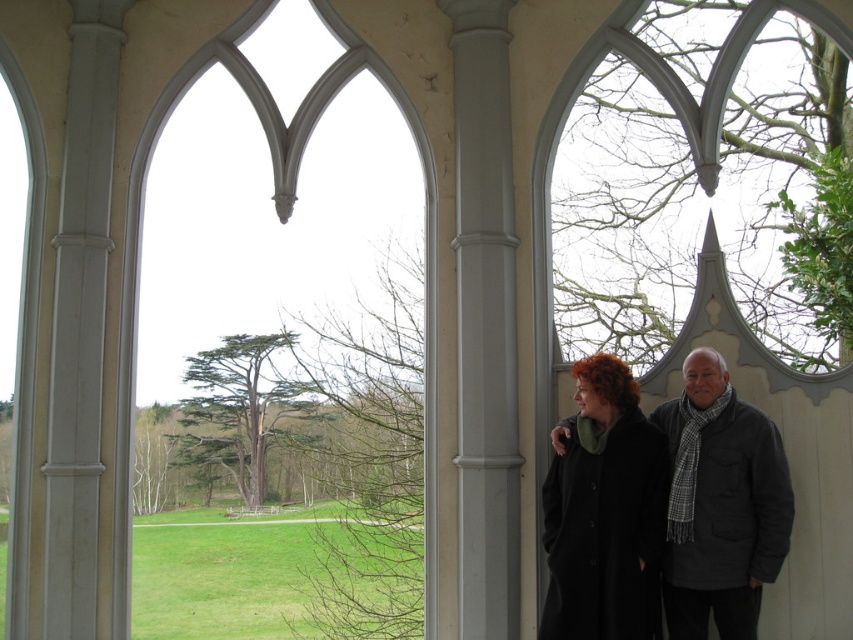
Who is lower down, clear glass window at center or gray smooth column at center?

clear glass window at center is lower down.

Does clear glass window at center have a greater height compared to gray smooth column at center?

Correct, clear glass window at center is much taller as gray smooth column at center.

Is point (364, 54) positioned after point (494, 396)?

Yes, it is behind point (494, 396).

The width and height of the screenshot is (853, 640). In order to click on clear glass window at center in this screenshot , I will do `click(271, 198)`.

Who is taller, black wool coat at center or dark gray wool scarf at right?

Standing taller between the two is dark gray wool scarf at right.

Who is positioned more to the right, black wool coat at center or dark gray wool scarf at right?

dark gray wool scarf at right

Does point (583, 385) come behind point (712, 500)?

Yes, point (583, 385) is farther from viewer.

I want to click on black wool coat at center, so click(x=604, y=512).

Does gray smooth column at center have a smaller size compared to dark gray wool scarf at right?

Incorrect, gray smooth column at center is not smaller in size than dark gray wool scarf at right.

Can you confirm if gray smooth column at center is positioned above dark gray wool scarf at right?

Yes, gray smooth column at center is above dark gray wool scarf at right.

The height and width of the screenshot is (640, 853). What are the coordinates of `gray smooth column at center` in the screenshot? It's located at (485, 323).